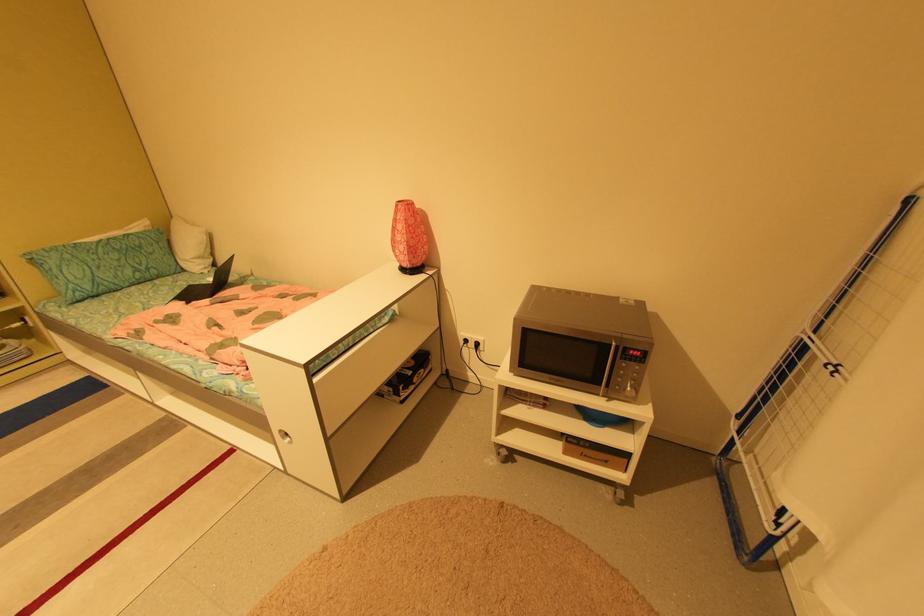
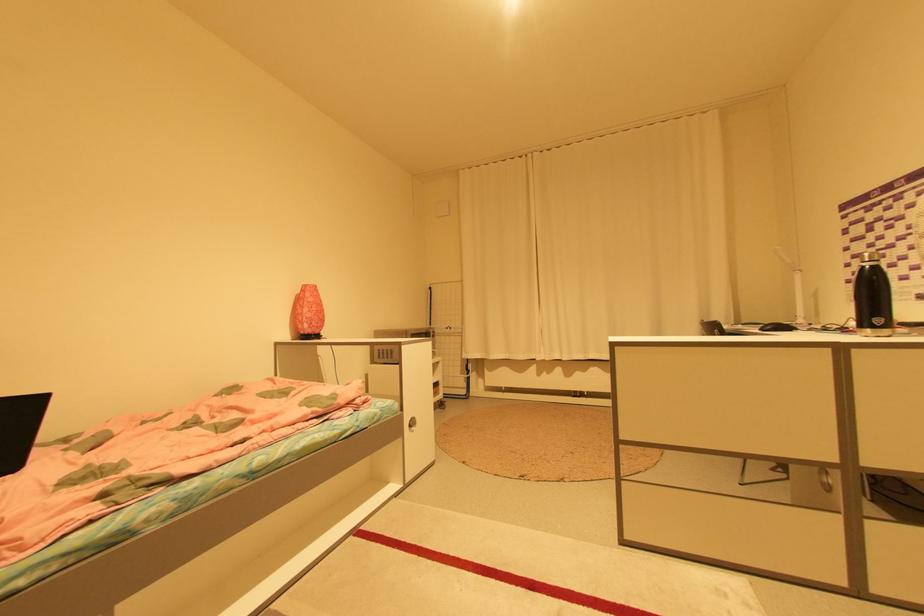
Find the pixel in the second image that matches point (406, 201) in the first image.

(311, 285)